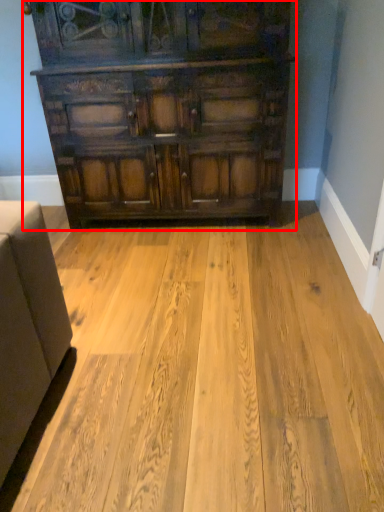
Question: From the image's perspective, where is chest of drawers (annotated by the red box) located relative to plywood?

Choices:
 (A) below
 (B) above

Answer: (B)